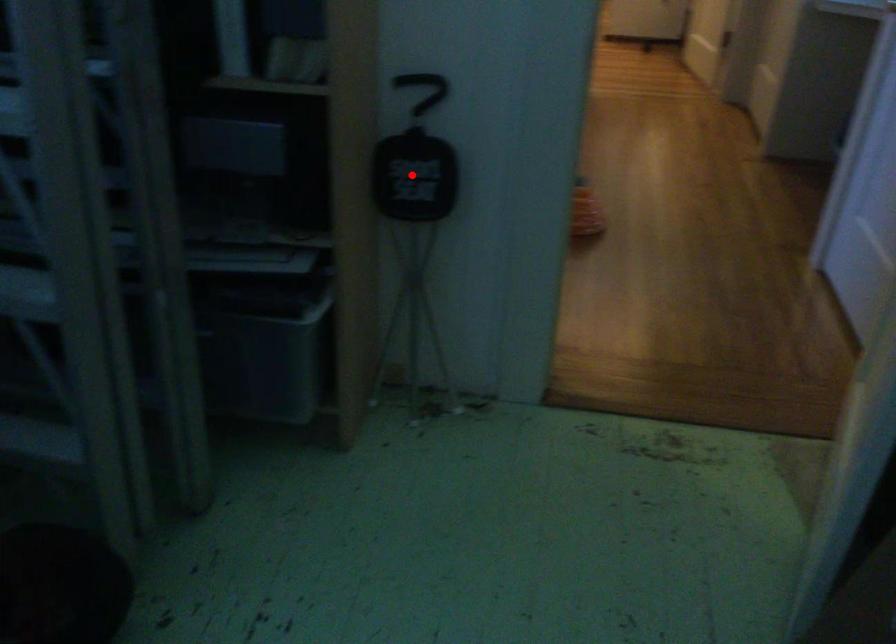
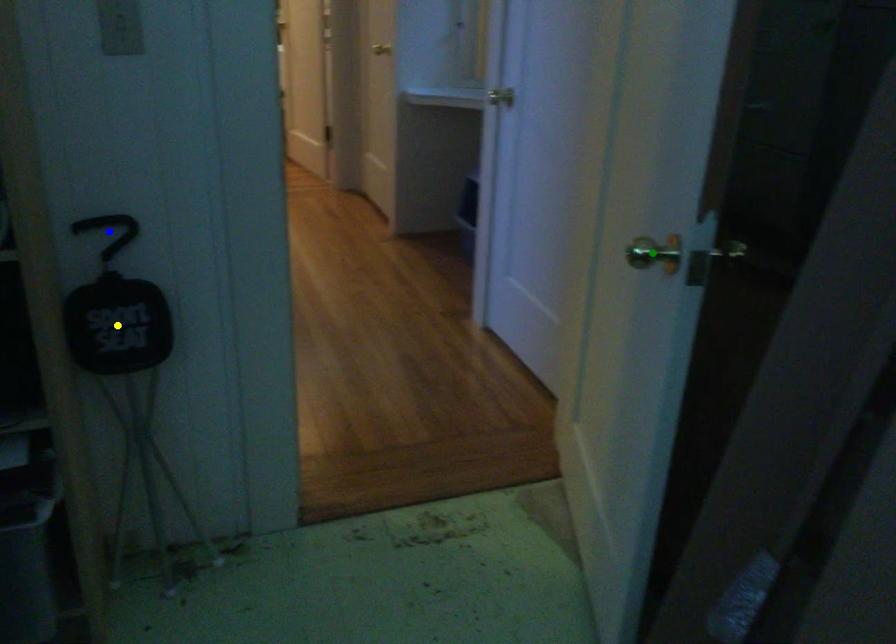
Question: I am providing you with two images of the same scene from different viewpoints. A red point is marked on the first image. You are given multiple points on the second image. Which point in image 2 represents the same 3d spot as the red point in image 1?

Choices:
 (A) green point
 (B) yellow point
 (C) blue point

Answer: (B)